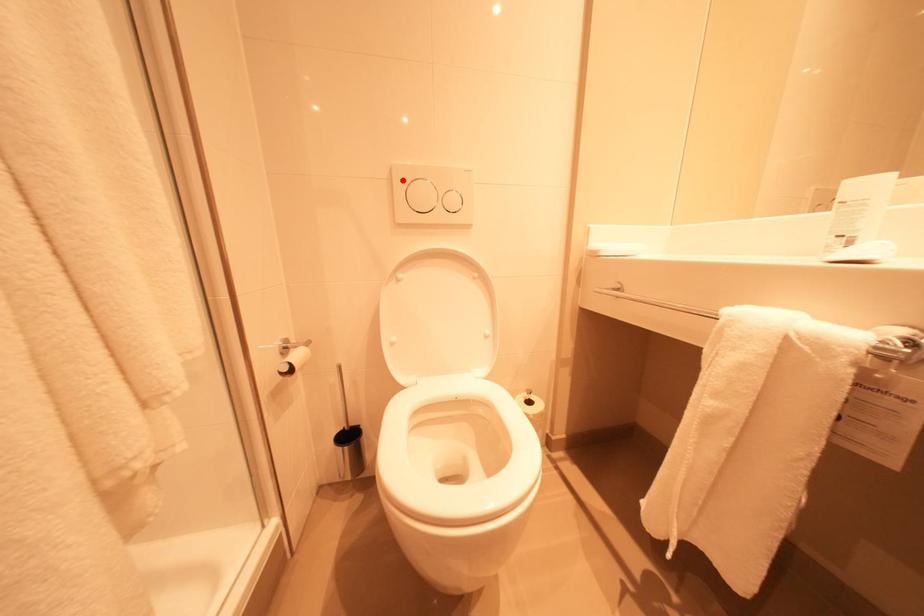
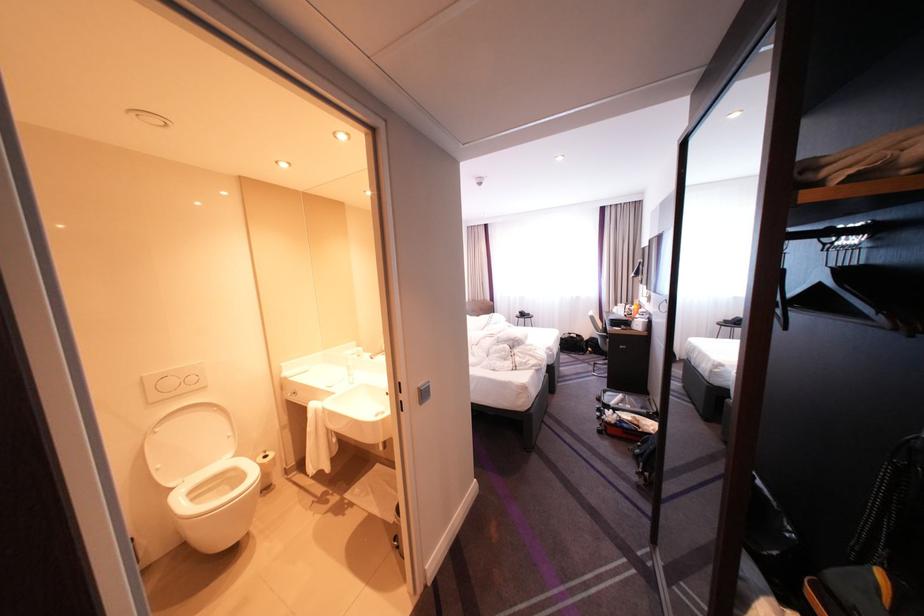
Locate, in the second image, the point that corresponds to the highlighted location in the first image.

(154, 384)